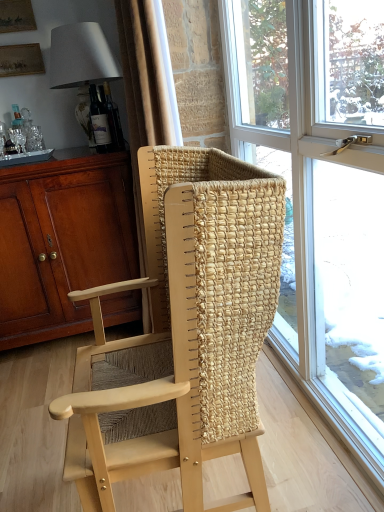
In order to click on clear glass window at center in this screenshot , I will do `click(321, 192)`.

The image size is (384, 512). I want to click on matte gray lampshade at upper left, so click(80, 56).

You are a GUI agent. You are given a task and a screenshot of the screen. Output one action in this format:
    pyautogui.click(x=<x>, y=<y>)
    Task: Click on the natural woven wood chair at center
    This screenshot has height=512, width=384.
    Given the screenshot: What is the action you would take?
    pyautogui.click(x=187, y=335)

Identify the location of beige fabric curtain at upper center. The image size is (384, 512). (146, 123).

I want to click on clear glass window at center, so click(x=321, y=192).

From the image's perspective, relative to matte brown cabinet at left, is clear glass window at center above or below?

clear glass window at center is situated higher than matte brown cabinet at left in the image.

Is clear glass window at center with matte brown cabinet at left?

No, clear glass window at center is not beside matte brown cabinet at left.

Considering the positions of objects clear glass window at center and matte brown cabinet at left in the image provided, who is behind, clear glass window at center or matte brown cabinet at left?

Positioned behind is matte brown cabinet at left.

Considering the sizes of objects clear glass window at center and matte brown cabinet at left in the image provided, who is smaller, clear glass window at center or matte brown cabinet at left?

clear glass window at center is smaller.

Would you consider beige fabric curtain at upper center to be distant from matte gray lampshade at upper left?

No, beige fabric curtain at upper center is not far from matte gray lampshade at upper left.

Is beige fabric curtain at upper center not inside matte gray lampshade at upper left?

beige fabric curtain at upper center is positioned outside matte gray lampshade at upper left.

How many degrees apart are the facing directions of beige fabric curtain at upper center and matte gray lampshade at upper left?

They differ by 89.2 degrees in their facing directions.

In the scene shown: From a real-world perspective, is beige fabric curtain at upper center physically located above or below matte gray lampshade at upper left?

From a real-world perspective, beige fabric curtain at upper center is physically below matte gray lampshade at upper left.

Considering the relative sizes of clear glass window at center and matte gray lampshade at upper left in the image provided, is clear glass window at center shorter than matte gray lampshade at upper left?

No, clear glass window at center is not shorter than matte gray lampshade at upper left.

Between clear glass window at center and matte gray lampshade at upper left, which one has smaller size?

With smaller size is matte gray lampshade at upper left.

Would you say clear glass window at center is outside matte gray lampshade at upper left?

Yes.

Which object is thinner, matte gray lampshade at upper left or matte brown cabinet at left?

matte gray lampshade at upper left is thinner.

From a real-world perspective, is matte gray lampshade at upper left over matte brown cabinet at left?

Correct, in the physical world, matte gray lampshade at upper left is higher than matte brown cabinet at left.

Measure the distance from matte gray lampshade at upper left to matte brown cabinet at left.

matte gray lampshade at upper left and matte brown cabinet at left are 28.30 inches apart from each other.

Which of these two, matte gray lampshade at upper left or matte brown cabinet at left, stands taller?

Standing taller between the two is matte brown cabinet at left.

From the picture: From the image's perspective, is matte brown cabinet at left located beneath beige fabric curtain at upper center?

Yes, from the image's perspective, matte brown cabinet at left is beneath beige fabric curtain at upper center.

What's the angular difference between matte brown cabinet at left and beige fabric curtain at upper center's facing directions?

The angular difference between matte brown cabinet at left and beige fabric curtain at upper center is 91 degrees.

Is matte brown cabinet at left wider than beige fabric curtain at upper center?

Correct, the width of matte brown cabinet at left exceeds that of beige fabric curtain at upper center.

Which is closer to the camera, (134,248) or (149,100)?

The point (149,100) is closer to the camera.

Is matte brown cabinet at left inside beige fabric curtain at upper center?

No, matte brown cabinet at left is located outside of beige fabric curtain at upper center.

Which of these two, beige fabric curtain at upper center or matte brown cabinet at left, stands shorter?

matte brown cabinet at left is shorter.

Could you tell me if beige fabric curtain at upper center is turned towards matte brown cabinet at left?

No, beige fabric curtain at upper center is not oriented towards matte brown cabinet at left.

Which point is more distant from viewer, (358,442) or (158,78)?

Positioned behind is point (158,78).

Looking at this image, from the image's perspective, who appears lower, clear glass window at center or beige fabric curtain at upper center?

clear glass window at center appears lower in the image.

Is clear glass window at center positioned far away from beige fabric curtain at upper center?

No, clear glass window at center is in close proximity to beige fabric curtain at upper center.

You are a GUI agent. You are given a task and a screenshot of the screen. Output one action in this format:
    pyautogui.click(x=<x>, y=<y>)
    Task: Click on the window that appears above the matte brown cabinet at left (from a real-world perspective)
    
    Given the screenshot: What is the action you would take?
    pyautogui.click(x=321, y=192)

Where is `lamp that is above the beige fabric curtain at upper center (from the image's perspective)`? The width and height of the screenshot is (384, 512). lamp that is above the beige fabric curtain at upper center (from the image's perspective) is located at coordinates (80, 56).

Estimate the real-world distances between objects in this image. Which object is further from matte gray lampshade at upper left, matte brown cabinet at left or beige fabric curtain at upper center?

The object further to matte gray lampshade at upper left is matte brown cabinet at left.

Considering their positions, is natural woven wood chair at center positioned closer to clear glass window at center than matte gray lampshade at upper left?

natural woven wood chair at center is closer to clear glass window at center.

Considering their positions, is clear glass window at center positioned further to matte gray lampshade at upper left than matte brown cabinet at left?

Among the two, clear glass window at center is located further to matte gray lampshade at upper left.

Estimate the real-world distances between objects in this image. Which object is further from matte brown cabinet at left, beige fabric curtain at upper center or matte gray lampshade at upper left?

The object further to matte brown cabinet at left is matte gray lampshade at upper left.

From the picture: Looking at the image, which one is located closer to clear glass window at center, beige fabric curtain at upper center or natural woven wood chair at center?

Based on the image, natural woven wood chair at center appears to be nearer to clear glass window at center.

Considering their positions, is natural woven wood chair at center positioned closer to matte gray lampshade at upper left than clear glass window at center?

The object closer to matte gray lampshade at upper left is clear glass window at center.

Considering their positions, is beige fabric curtain at upper center positioned further to natural woven wood chair at center than matte gray lampshade at upper left?

matte gray lampshade at upper left.

Based on their spatial positions, is matte brown cabinet at left or natural woven wood chair at center closer to clear glass window at center?

Based on the image, natural woven wood chair at center appears to be nearer to clear glass window at center.

The image size is (384, 512). Find the location of `curtain located between natural woven wood chair at center and matte gray lampshade at upper left in the depth direction`. curtain located between natural woven wood chair at center and matte gray lampshade at upper left in the depth direction is located at coordinates click(x=146, y=123).

Locate an element on the screen. This screenshot has width=384, height=512. curtain between clear glass window at center and matte gray lampshade at upper left along the z-axis is located at coordinates (146, 123).

The height and width of the screenshot is (512, 384). Find the location of `curtain between matte gray lampshade at upper left and matte brown cabinet at left vertically`. curtain between matte gray lampshade at upper left and matte brown cabinet at left vertically is located at coordinates (146, 123).

Locate an element on the screen. cabinetry located between natural woven wood chair at center and matte gray lampshade at upper left in the depth direction is located at coordinates (62, 241).